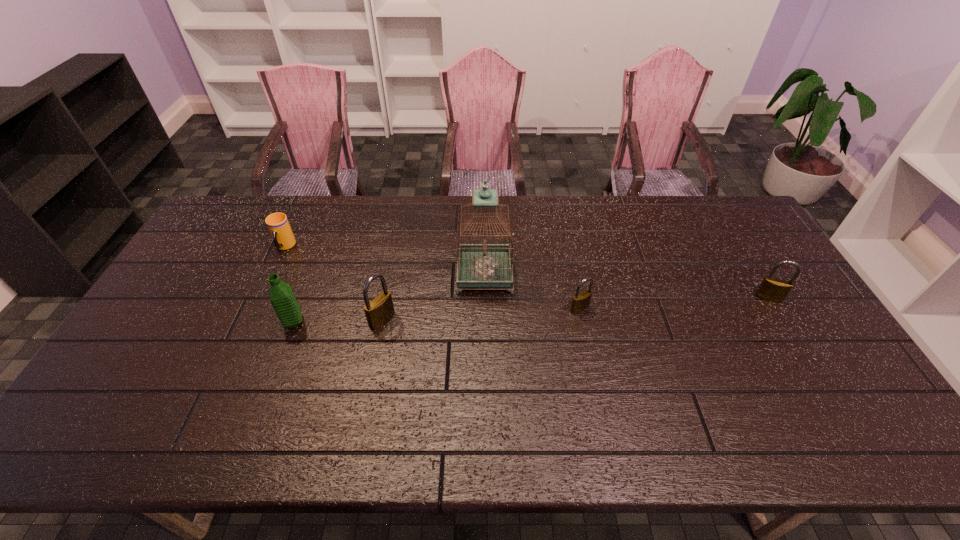
This screenshot has width=960, height=540. In order to click on vacant area that satisfies the following two spatial constraints: 1. on the back side of the third shortest object; 2. on the right side of the second object from left to right in this screenshot , I will do `click(302, 298)`.

Where is `blank space that satisfies the following two spatial constraints: 1. on the side of the fifth object from right to left with the handle; 2. on the left side of the leftmost object`? The height and width of the screenshot is (540, 960). blank space that satisfies the following two spatial constraints: 1. on the side of the fifth object from right to left with the handle; 2. on the left side of the leftmost object is located at coordinates (251, 322).

The width and height of the screenshot is (960, 540). What are the coordinates of `vacant position in the image that satisfies the following two spatial constraints: 1. on the back side of the leftmost padlock; 2. on the right side of the second padlock from right to left` in the screenshot? It's located at (384, 308).

Locate an element on the screen. This screenshot has width=960, height=540. free spot that satisfies the following two spatial constraints: 1. at the door of the birdcage; 2. on the right side of the shortest padlock is located at coordinates (485, 308).

Locate an element on the screen. vacant point that satisfies the following two spatial constraints: 1. at the door of the birdcage; 2. on the left side of the rightmost padlock is located at coordinates (485, 298).